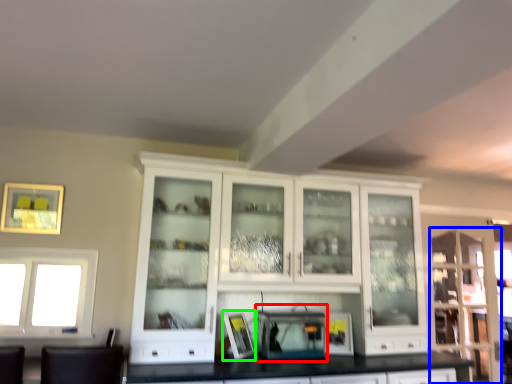
Question: Based on their relative distances, which object is nearer to appliance (highlighted by a red box)? Choose from glass door (highlighted by a blue box) and picture frame (highlighted by a green box).

Choices:
 (A) glass door
 (B) picture frame

Answer: (B)